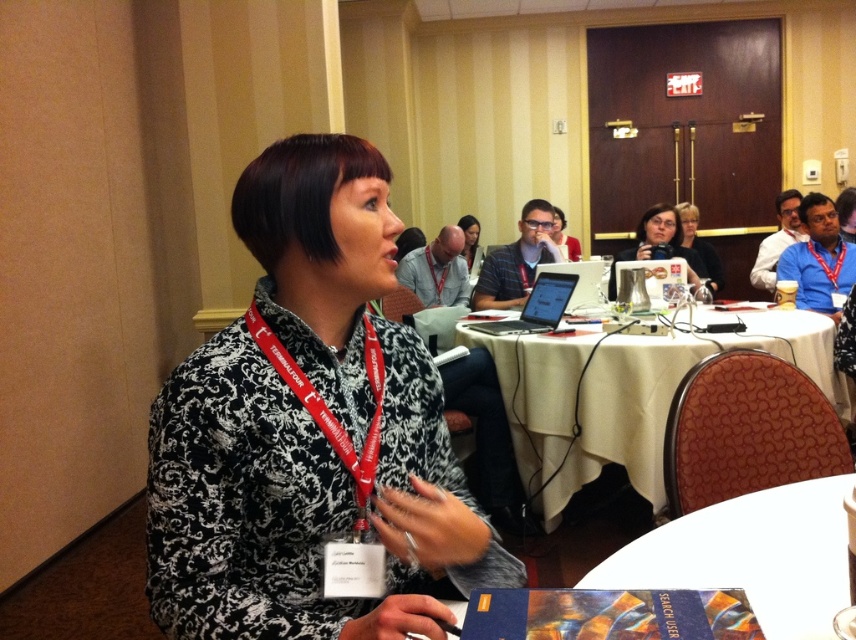
Can you confirm if white glossy book at lower center is wider than matte white mug at upper center?

Incorrect, white glossy book at lower center's width does not surpass matte white mug at upper center's.

Between point (746, 588) and point (637, 250), which one is positioned behind?

Positioned behind is point (637, 250).

I want to click on white glossy book at lower center, so click(x=752, y=556).

Which of these two, white fabric table at center or black matte laptop at center, stands shorter?

With less height is black matte laptop at center.

Looking at this image, can you confirm if white fabric table at center is positioned to the right of black matte laptop at center?

Correct, you'll find white fabric table at center to the right of black matte laptop at center.

Is point (513, 365) closer to viewer compared to point (553, 323)?

Yes.

Where is `white fabric table at center`? This screenshot has width=856, height=640. white fabric table at center is located at coordinates (627, 394).

Is black printed shirt at center to the right of blue lanyard at upper right from the viewer's perspective?

Incorrect, black printed shirt at center is not on the right side of blue lanyard at upper right.

From the picture: Who is positioned more to the right, black printed shirt at center or blue lanyard at upper right?

blue lanyard at upper right is more to the right.

Find the location of a particular element. black printed shirt at center is located at coordinates 308,428.

Where is `black printed shirt at center`? The image size is (856, 640). black printed shirt at center is located at coordinates point(308,428).